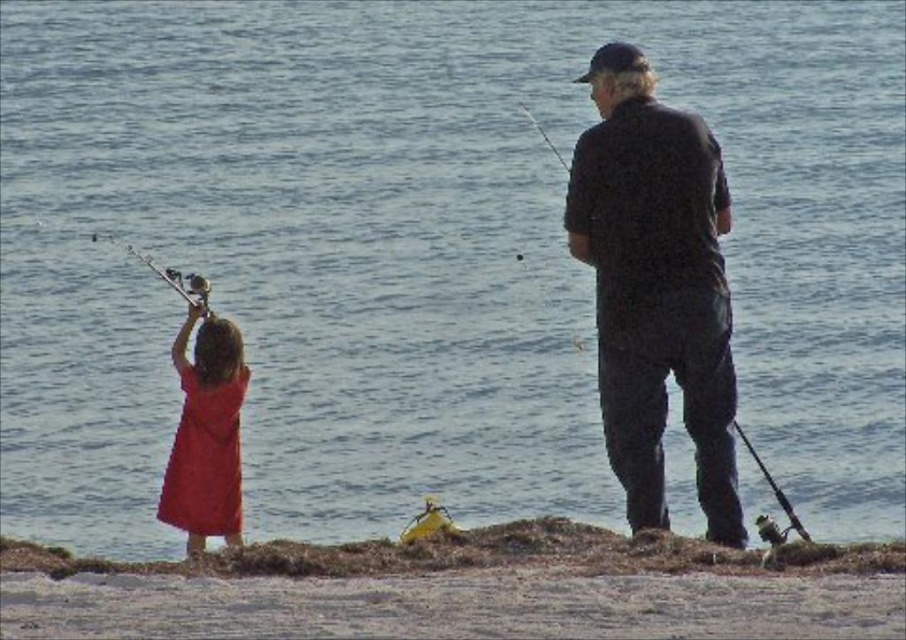
Who is higher up, dark gray cotton shirt at right or matte red dress at left?

dark gray cotton shirt at right is above.

Does point (673, 150) come behind point (162, 516)?

No, it is in front of (162, 516).

Does point (635, 374) come farther from viewer compared to point (217, 465)?

No.

This screenshot has width=906, height=640. Find the location of `dark gray cotton shirt at right`. dark gray cotton shirt at right is located at coordinates (656, 288).

Between brown seaweed at lower center and dark gray cotton shirt at right, which one has more height?

With more height is dark gray cotton shirt at right.

Between brown seaweed at lower center and dark gray cotton shirt at right, which one appears on the right side from the viewer's perspective?

Positioned to the right is dark gray cotton shirt at right.

Where is `brown seaweed at lower center`? brown seaweed at lower center is located at coordinates (463, 588).

Where is `brown seaweed at lower center`? The image size is (906, 640). brown seaweed at lower center is located at coordinates (463, 588).

Is brown seaweed at lower center taller than matte red dress at left?

No, brown seaweed at lower center is not taller than matte red dress at left.

Between brown seaweed at lower center and matte red dress at left, which one is positioned lower?

Positioned lower is brown seaweed at lower center.

Which is in front, point (130, 600) or point (182, 438)?

Point (130, 600) is in front.

Where is `brown seaweed at lower center`? Image resolution: width=906 pixels, height=640 pixels. brown seaweed at lower center is located at coordinates (463, 588).